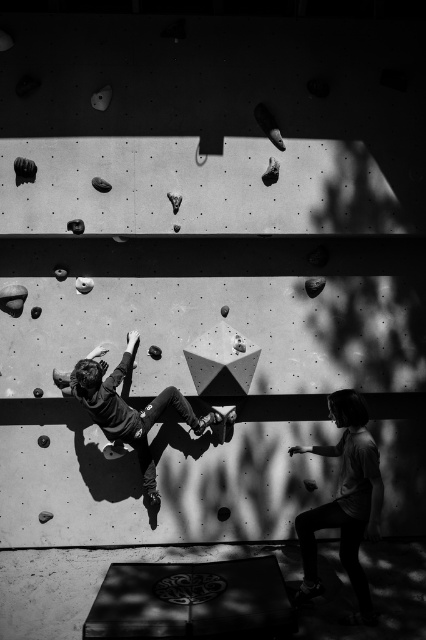
Is point (370, 534) farther from viewer compared to point (83, 364)?

No, it is not.

Does light gray cotton shirt at lower right have a greater height compared to smooth gray climbing hold at center?

Indeed, light gray cotton shirt at lower right has a greater height compared to smooth gray climbing hold at center.

Between point (363, 429) and point (89, 381), which one is positioned behind?

The point (89, 381) is behind.

I want to click on light gray cotton shirt at lower right, so (345, 499).